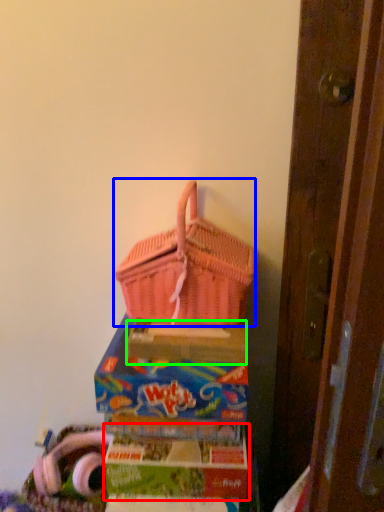
Question: Which object is positioned farthest from box (highlighted by a red box)? Select from picnic basket (highlighted by a blue box) and cardboard box (highlighted by a green box).

Choices:
 (A) picnic basket
 (B) cardboard box

Answer: (A)